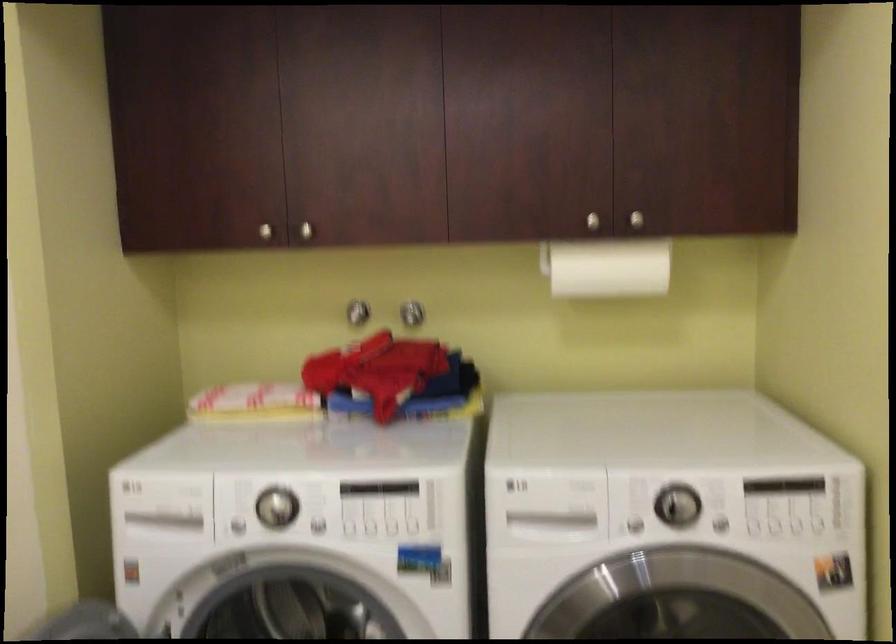
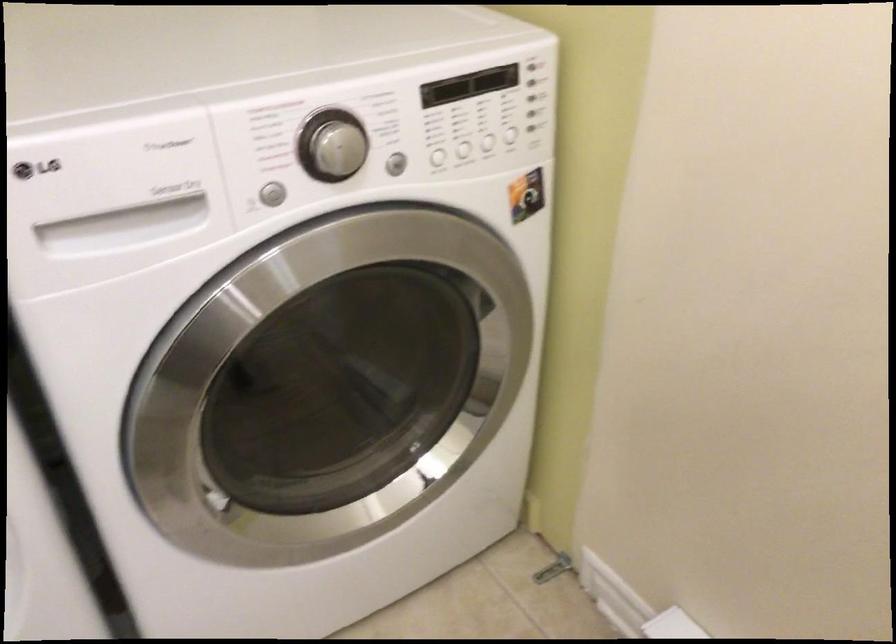
Where in the second image is the point corresponding to pixel 576 521 from the first image?

(164, 210)